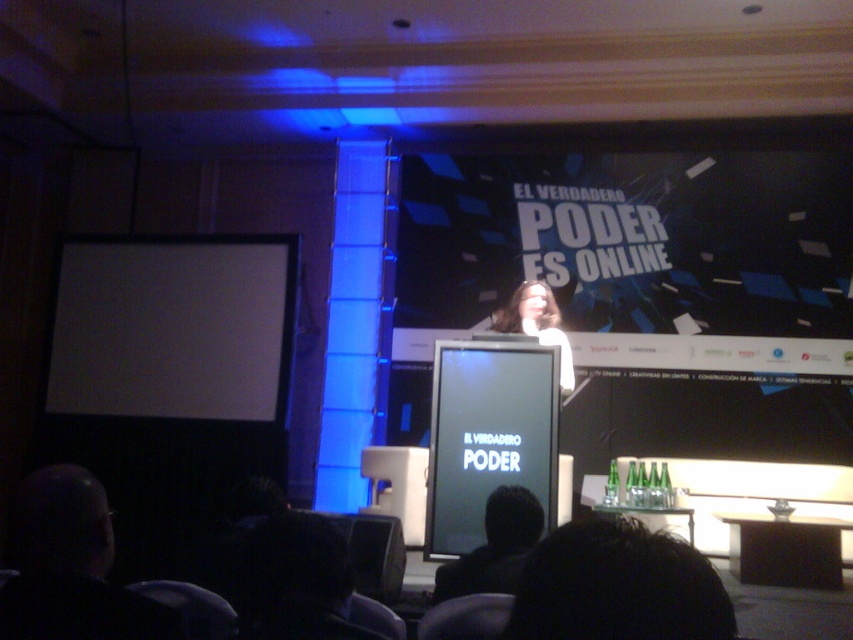
Who is taller, dark hair at lower left or white matte hair at center?

white matte hair at center is taller.

Does dark hair at lower left have a larger size compared to white matte hair at center?

Incorrect, dark hair at lower left is not larger than white matte hair at center.

Does point (25, 636) lie behind point (508, 316)?

No, it is in front of (508, 316).

I want to click on dark hair at lower left, so click(73, 568).

Is black glossy projection screen at center taller than dark hair at lower left?

Yes.

Between black glossy projection screen at center and dark hair at lower left, which one is positioned lower?

black glossy projection screen at center is lower down.

Where is `black glossy projection screen at center`? Image resolution: width=853 pixels, height=640 pixels. black glossy projection screen at center is located at coordinates (488, 436).

Can you confirm if white matte projection screen at left is shorter than black glossy projection screen at center?

Yes, white matte projection screen at left is shorter than black glossy projection screen at center.

Between point (236, 323) and point (468, 483), which one is positioned in front?

Point (468, 483)

The image size is (853, 640). Describe the element at coordinates (173, 326) in the screenshot. I see `white matte projection screen at left` at that location.

Where is `white matte projection screen at left`? white matte projection screen at left is located at coordinates (173, 326).